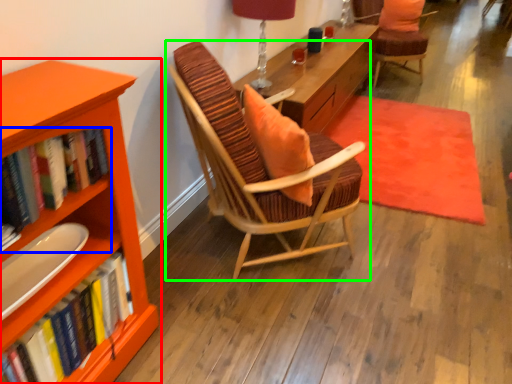
Question: Considering the real-world distances, which object is farthest from bookcase (highlighted by a red box)? book (highlighted by a blue box) or chair (highlighted by a green box)?

Choices:
 (A) book
 (B) chair

Answer: (B)